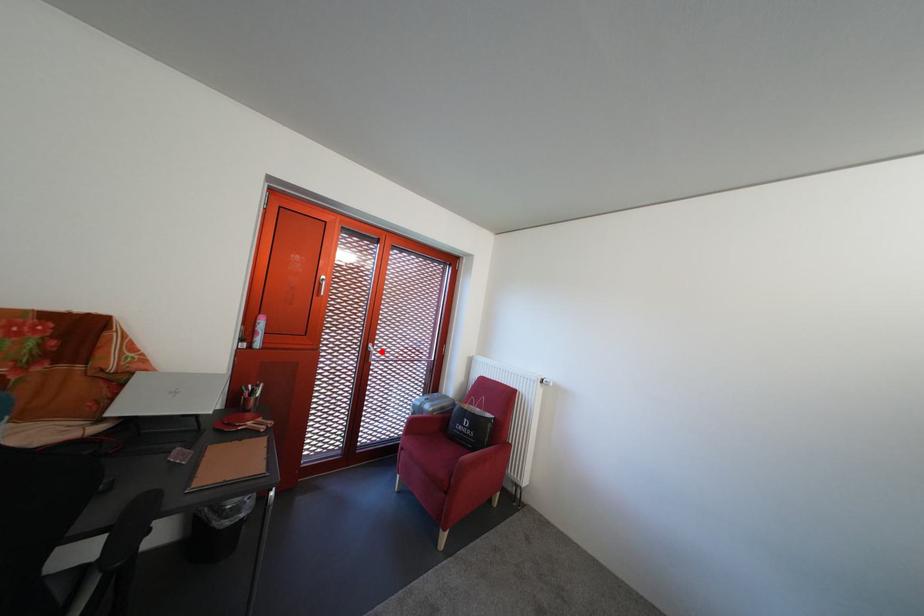
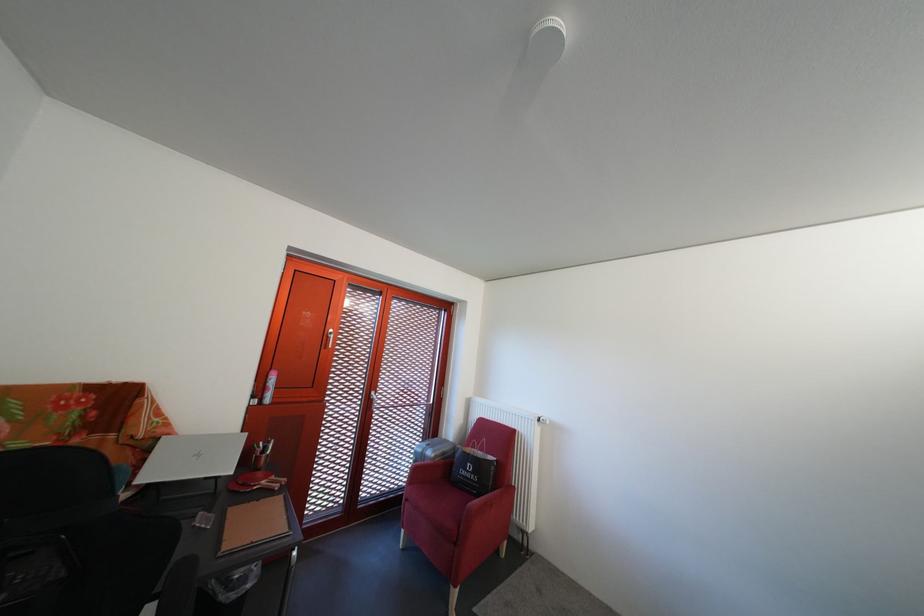
Question: I am providing you with two images of the same scene from different viewpoints. Image1 has a red point marked. In image2, the corresponding 3D location appears at what relative position? Reply with the corresponding letter.

Choices:
 (A) Closer
 (B) Farther

Answer: (A)